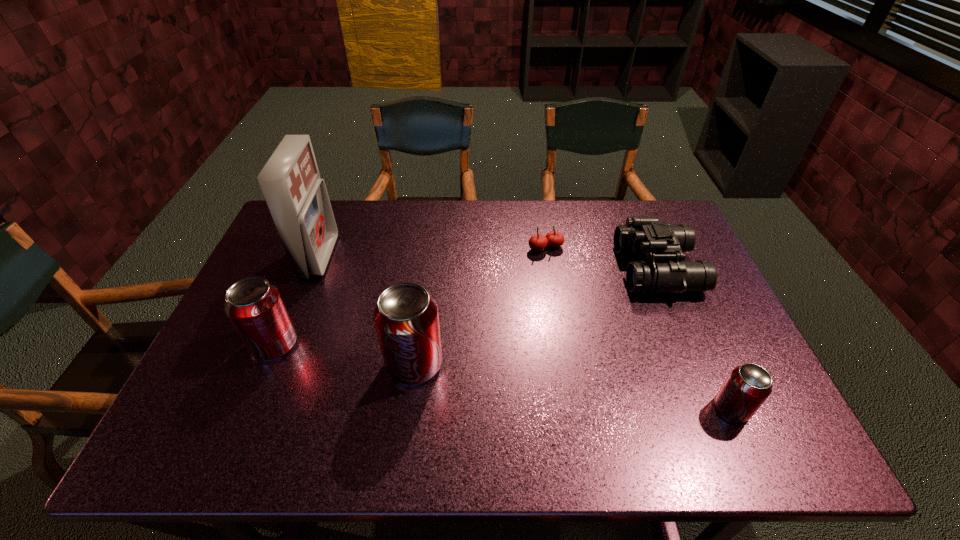
Where is `free spot located on the front of the second soda can from right to left`? free spot located on the front of the second soda can from right to left is located at coordinates (409, 408).

The height and width of the screenshot is (540, 960). Identify the location of vacant space located on the left of the shortest soda can. (679, 409).

At what (x,y) coordinates should I click in order to perform the action: click on vacant space situated 0.190m on the front-facing side of the tallest object. Please return your answer as a coordinate pair (x, y). Looking at the image, I should click on (393, 257).

Where is `vacant space situated on the right of the cherry`? vacant space situated on the right of the cherry is located at coordinates (664, 248).

This screenshot has width=960, height=540. I want to click on free point located through the lenses of the binoculars, so click(584, 269).

You are a GUI agent. You are given a task and a screenshot of the screen. Output one action in this format:
    pyautogui.click(x=<x>, y=<y>)
    Task: Click on the vacant area situated 0.170m through the lenses of the binoculars
    
    Given the screenshot: What is the action you would take?
    [564, 269]

Where is `vacant space located through the lenses of the binoculars`? Image resolution: width=960 pixels, height=540 pixels. vacant space located through the lenses of the binoculars is located at coordinates (500, 269).

You are a GUI agent. You are given a task and a screenshot of the screen. Output one action in this format:
    pyautogui.click(x=<x>, y=<y>)
    Task: Click on the first-aid kit that is at the far edge
    This screenshot has height=540, width=960.
    Given the screenshot: What is the action you would take?
    pyautogui.click(x=297, y=198)

Where is `cherry present at the far edge`? This screenshot has width=960, height=540. cherry present at the far edge is located at coordinates (538, 242).

You are a GUI agent. You are given a task and a screenshot of the screen. Output one action in this format:
    pyautogui.click(x=<x>, y=<y>)
    Task: Click on the binoculars that is at the far edge
    This screenshot has width=960, height=540.
    Given the screenshot: What is the action you would take?
    pyautogui.click(x=647, y=236)